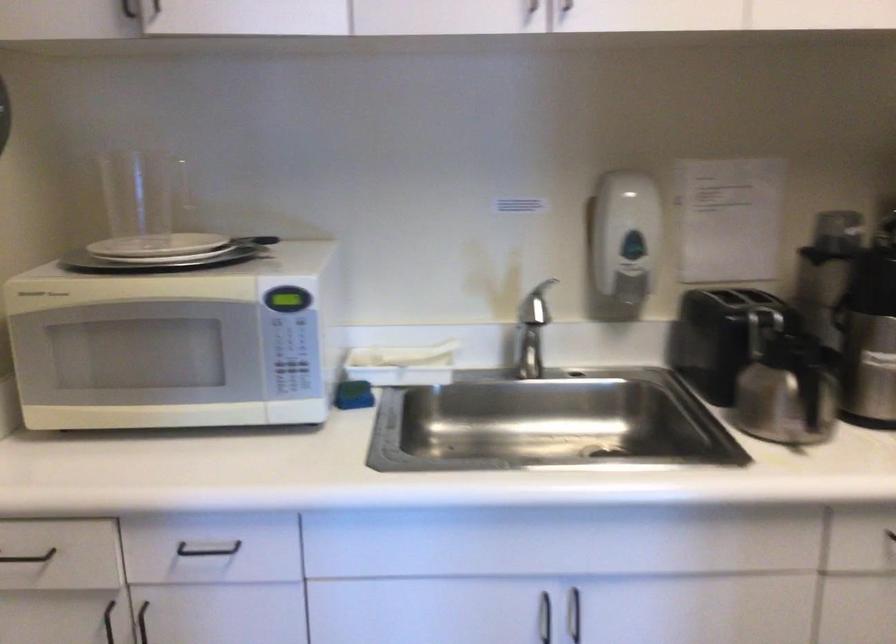
In order to click on blue and green sponge in this screenshot , I will do `click(352, 395)`.